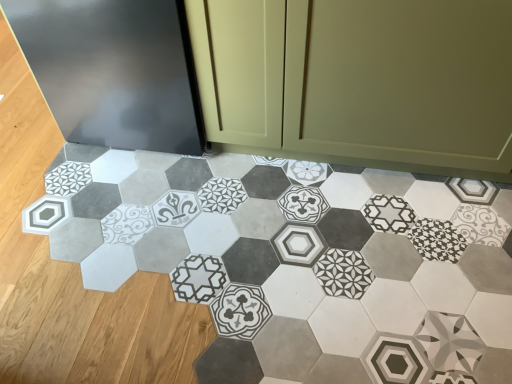
Question: Is matte olive green cabinet at center bigger than patterned ceramic tile at center?

Choices:
 (A) yes
 (B) no

Answer: (A)

Question: Considering the relative sizes of matte olive green cabinet at center and patterned ceramic tile at center in the image provided, is matte olive green cabinet at center taller than patterned ceramic tile at center?

Choices:
 (A) yes
 (B) no

Answer: (A)

Question: Is matte olive green cabinet at center to the left of patterned ceramic tile at center from the viewer's perspective?

Choices:
 (A) yes
 (B) no

Answer: (B)

Question: Does matte olive green cabinet at center have a lesser height compared to patterned ceramic tile at center?

Choices:
 (A) no
 (B) yes

Answer: (A)

Question: Could patterned ceramic tile at center be considered to be inside matte olive green cabinet at center?

Choices:
 (A) yes
 (B) no

Answer: (B)

Question: From the image's perspective, does matte olive green cabinet at center appear higher than patterned ceramic tile at center?

Choices:
 (A) yes
 (B) no

Answer: (A)

Question: Considering the relative sizes of patterned ceramic tile at center and matte olive green cabinet at center in the image provided, is patterned ceramic tile at center taller than matte olive green cabinet at center?

Choices:
 (A) no
 (B) yes

Answer: (A)

Question: Does patterned ceramic tile at center come behind matte olive green cabinet at center?

Choices:
 (A) no
 (B) yes

Answer: (A)

Question: Is patterned ceramic tile at center positioned far away from matte olive green cabinet at center?

Choices:
 (A) no
 (B) yes

Answer: (A)

Question: Is patterned ceramic tile at center with matte olive green cabinet at center?

Choices:
 (A) no
 (B) yes

Answer: (A)

Question: Can you confirm if patterned ceramic tile at center is smaller than matte olive green cabinet at center?

Choices:
 (A) yes
 (B) no

Answer: (A)

Question: From the image's perspective, is patterned ceramic tile at center located above matte olive green cabinet at center?

Choices:
 (A) yes
 (B) no

Answer: (B)

Question: From a real-world perspective, is matte olive green cabinet at center above or below patterned ceramic tile at center?

Choices:
 (A) above
 (B) below

Answer: (A)